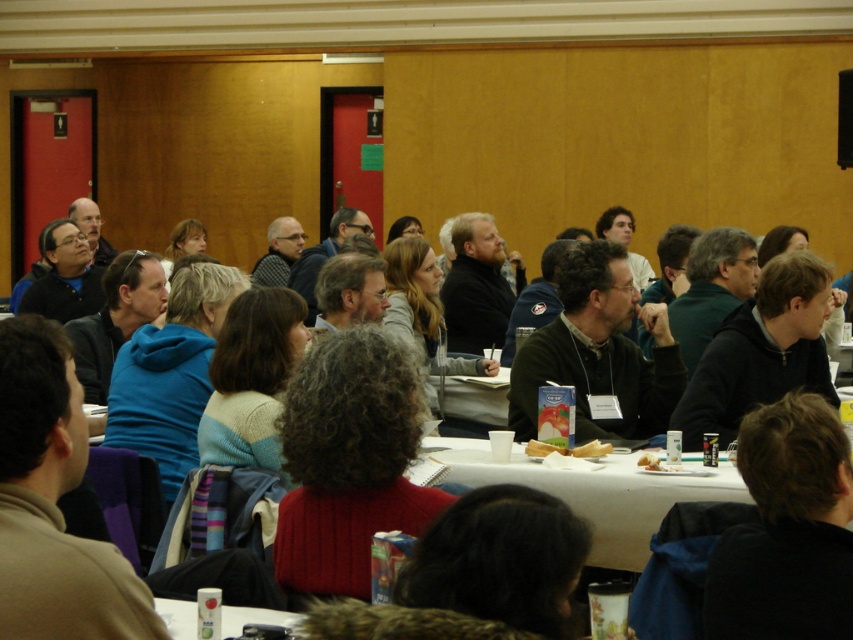
You are organizing a meeting in this conference room and need to place a new item on the table. You want to ensure that the new item is placed between the blue fleece jacket at left and the white paper plate at center. Where should you place the new item?

The blue fleece jacket at left is located above the white paper plate at center. To place the new item between them, position it below the blue fleece jacket at left and above the white paper plate at center.

You are standing in the conference room and see the point at coordinates (x=53, y=502). Which object is this point located on?

The point at coordinates (x=53, y=502) is located on the blue fleece jacket at left.

You are organizing a coat rack for the conference attendees. The blue fleece jacket at left and the dark green sweater at center need to be hung. Which one requires less space on the coat rack?

The blue fleece jacket at left requires less space on the coat rack because it has a smaller size compared to the dark green sweater at center.